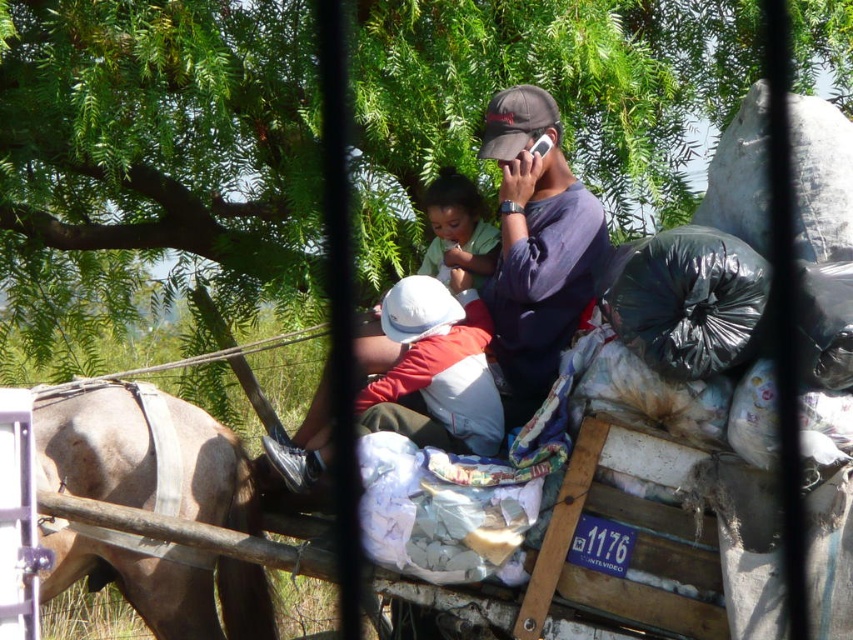
Does brown leather harness at left have a lesser width compared to dark blue fabric at center?

No.

Who is more forward, [88,458] or [566,198]?

Point [88,458] is more forward.

Between point (231, 442) and point (521, 161), which one is positioned in front?

Point (231, 442) is more forward.

Where is `brown leather harness at left`? brown leather harness at left is located at coordinates (144, 454).

Does brown leather harness at left have a larger size compared to soft white cloth at center?

Indeed, brown leather harness at left has a larger size compared to soft white cloth at center.

From the picture: Does brown leather harness at left appear under soft white cloth at center?

Yes.

Locate an element on the screen. The image size is (853, 640). brown leather harness at left is located at coordinates (x=144, y=454).

Is dark blue fabric at center smaller than soft white cloth at center?

No, dark blue fabric at center is not smaller than soft white cloth at center.

Which of these two, dark blue fabric at center or soft white cloth at center, stands taller?

With more height is dark blue fabric at center.

Between point (573, 212) and point (437, 186), which one is positioned behind?

The point (437, 186) is behind.

Where is `dark blue fabric at center`? The image size is (853, 640). dark blue fabric at center is located at coordinates (537, 244).